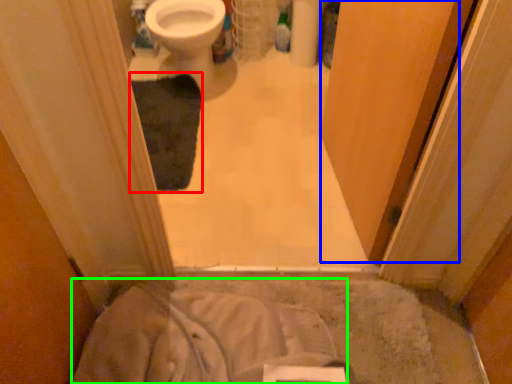
Question: Based on their relative distances, which object is farther from bath mat (highlighted by a red box)? Choose from screen door (highlighted by a blue box) and sheet (highlighted by a green box).

Choices:
 (A) screen door
 (B) sheet

Answer: (B)